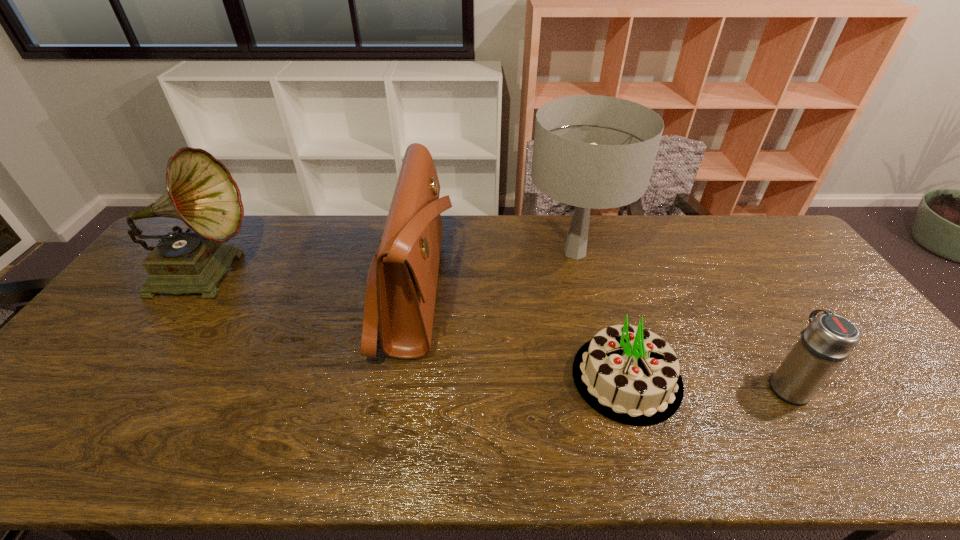
The image size is (960, 540). What are the coordinates of `lampshade` in the screenshot? It's located at (593, 152).

Identify the location of record player. (201, 192).

What are the coordinates of `the second object from left to right` in the screenshot? It's located at (401, 286).

The height and width of the screenshot is (540, 960). What are the coordinates of `the fourth tallest object` in the screenshot? It's located at (829, 339).

Where is `thermos bottle`? thermos bottle is located at coordinates (829, 339).

The width and height of the screenshot is (960, 540). Identify the location of the shortest object. (628, 374).

The image size is (960, 540). Identify the location of blank space located on the front-facing side of the lampshade. (612, 401).

The height and width of the screenshot is (540, 960). What are the coordinates of `vacant space located 0.090m from the horn of the record player` in the screenshot? It's located at (284, 272).

Where is `vacant space positioned on the front flap of the fourth object from right to left`? This screenshot has height=540, width=960. vacant space positioned on the front flap of the fourth object from right to left is located at coordinates (574, 290).

Identify the location of vacant point located 0.390m with a handle on the side of the rightmost object. The width and height of the screenshot is (960, 540). (715, 267).